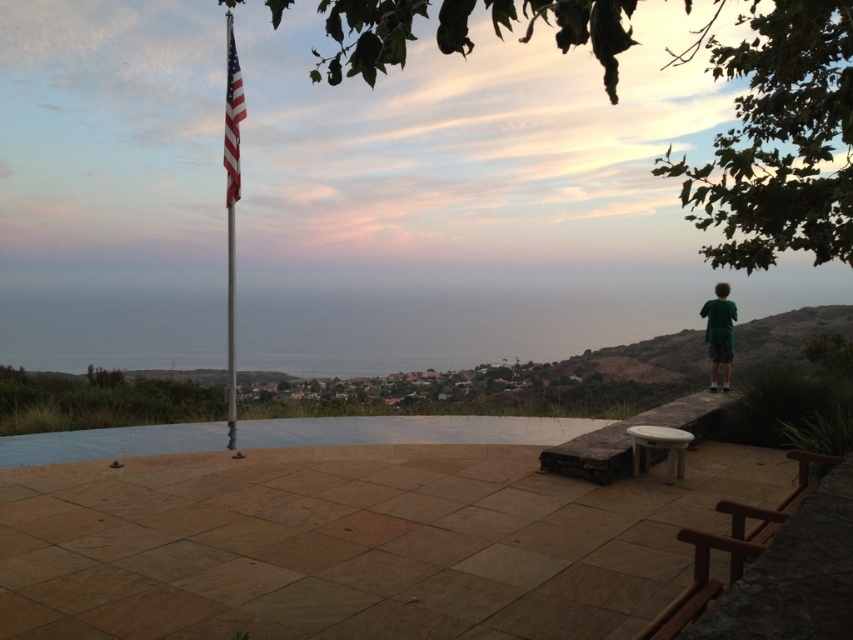
Who is more distant from viewer, (228, 122) or (225, 204)?

Positioned behind is point (225, 204).

Can you confirm if polished metal flag pole at center-left is smaller than american flag at upper left?

Correct, polished metal flag pole at center-left occupies less space than american flag at upper left.

Describe the element at coordinates (231, 196) in the screenshot. This screenshot has height=640, width=853. I see `polished metal flag pole at center-left` at that location.

The image size is (853, 640). What are the coordinates of `polished metal flag pole at center-left` in the screenshot? It's located at (231, 196).

Locate an element on the screen. Image resolution: width=853 pixels, height=640 pixels. polished metal flag pole at center-left is located at coordinates (231, 196).

I want to click on polished metal flag pole at center-left, so click(231, 196).

Where is `polished metal flag pole at center-left`? This screenshot has height=640, width=853. polished metal flag pole at center-left is located at coordinates (231, 196).

Who is more forward, (230,147) or (727,340)?

Positioned in front is point (230,147).

Which is in front, point (225, 106) or point (712, 324)?

Point (225, 106)

Where is `polished metal flag pole at center-left`? The image size is (853, 640). polished metal flag pole at center-left is located at coordinates (231, 196).